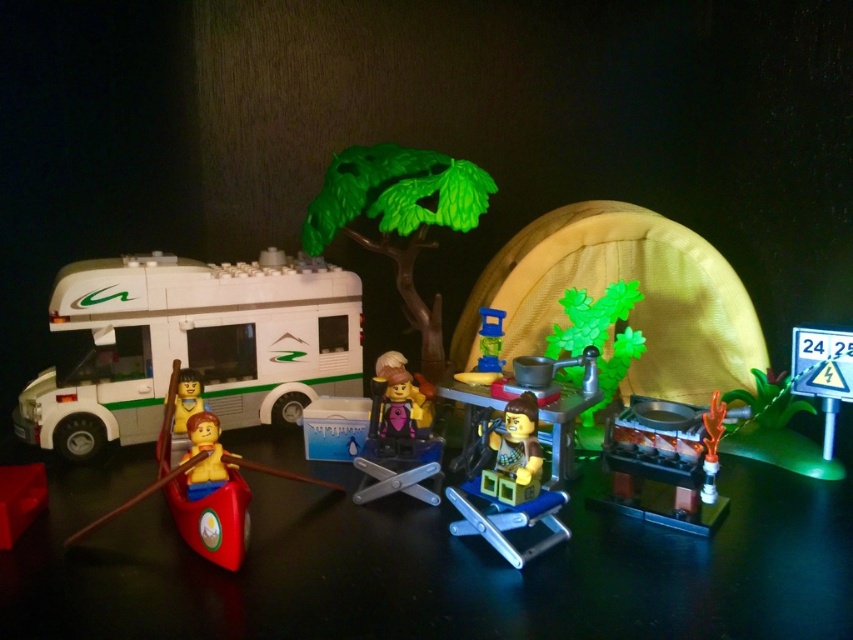
How far apart are white plastic recreational vehicle at left and yellow matte figure at lower left?

29.64 centimeters

The height and width of the screenshot is (640, 853). What do you see at coordinates (190, 346) in the screenshot? I see `white plastic recreational vehicle at left` at bounding box center [190, 346].

This screenshot has width=853, height=640. What are the coordinates of `white plastic recreational vehicle at left` in the screenshot? It's located at (190, 346).

Which is in front, point (296, 320) or point (712, 458)?

Point (712, 458) is more forward.

Locate an element on the screen. white plastic recreational vehicle at left is located at coordinates (190, 346).

Does shiny silver stove at lower right have a greater width compared to rubber boat at left?

No.

Is shiny silver stove at lower right bigger than rubber boat at left?

Incorrect, shiny silver stove at lower right is not larger than rubber boat at left.

The width and height of the screenshot is (853, 640). What are the coordinates of `shiny silver stove at lower right` in the screenshot? It's located at (666, 464).

Where is `shiny silver stove at lower right`? The width and height of the screenshot is (853, 640). shiny silver stove at lower right is located at coordinates (666, 464).